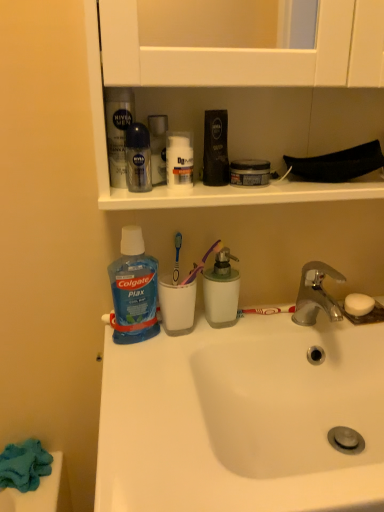
Question: Can you confirm if white matte jar at upper center, the 2th toiletry when ordered from right to left, is taller than blue translucent liquid at lower left?

Choices:
 (A) no
 (B) yes

Answer: (A)

Question: Does white matte jar at upper center, the 2th toiletry when ordered from right to left, have a smaller size compared to blue translucent liquid at lower left?

Choices:
 (A) no
 (B) yes

Answer: (B)

Question: From the image's perspective, is white matte jar at upper center, acting as the first toiletry starting from the left, located above blue translucent liquid at lower left?

Choices:
 (A) no
 (B) yes

Answer: (B)

Question: Does white matte jar at upper center, acting as the first toiletry starting from the left, appear on the left side of blue translucent liquid at lower left?

Choices:
 (A) yes
 (B) no

Answer: (B)

Question: Does white matte jar at upper center, the 2th toiletry when ordered from right to left, have a lesser width compared to blue translucent liquid at lower left?

Choices:
 (A) yes
 (B) no

Answer: (A)

Question: Is blue translucent liquid at lower left surrounded by white matte jar at upper center, the 2th toiletry when ordered from right to left?

Choices:
 (A) yes
 (B) no

Answer: (B)

Question: Considering the relative sizes of white ceramic sink at center, the 2th sink from the bottom, and blue translucent liquid at lower left in the image provided, is white ceramic sink at center, the 2th sink from the bottom, wider than blue translucent liquid at lower left?

Choices:
 (A) yes
 (B) no

Answer: (A)

Question: Is blue translucent liquid at lower left at the back of white ceramic sink at center, the 2th sink from the bottom?

Choices:
 (A) yes
 (B) no

Answer: (B)

Question: Are white ceramic sink at center, the 2th sink from the bottom, and blue translucent liquid at lower left making contact?

Choices:
 (A) yes
 (B) no

Answer: (B)

Question: Is white ceramic sink at center, acting as the 1th sink starting from the top, thinner than blue translucent liquid at lower left?

Choices:
 (A) no
 (B) yes

Answer: (A)

Question: Considering the relative sizes of white ceramic sink at center, the 2th sink from the bottom, and blue translucent liquid at lower left in the image provided, is white ceramic sink at center, the 2th sink from the bottom, shorter than blue translucent liquid at lower left?

Choices:
 (A) no
 (B) yes

Answer: (B)

Question: Is white ceramic sink at center, the 2th sink from the bottom, outside blue translucent liquid at lower left?

Choices:
 (A) yes
 (B) no

Answer: (A)

Question: From a real-world perspective, is matte black shaving cream at upper center, acting as the 2th toiletry starting from the left, on top of translucent plastic mouthwash at center, the 2th mouthwash in the right-to-left sequence?

Choices:
 (A) yes
 (B) no

Answer: (A)